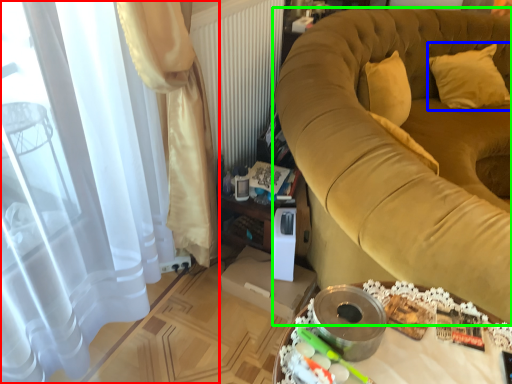
Question: Based on their relative distances, which object is farther from curtain (highlighted by a red box)? Choose from pillow (highlighted by a blue box) and furniture (highlighted by a green box).

Choices:
 (A) pillow
 (B) furniture

Answer: (A)